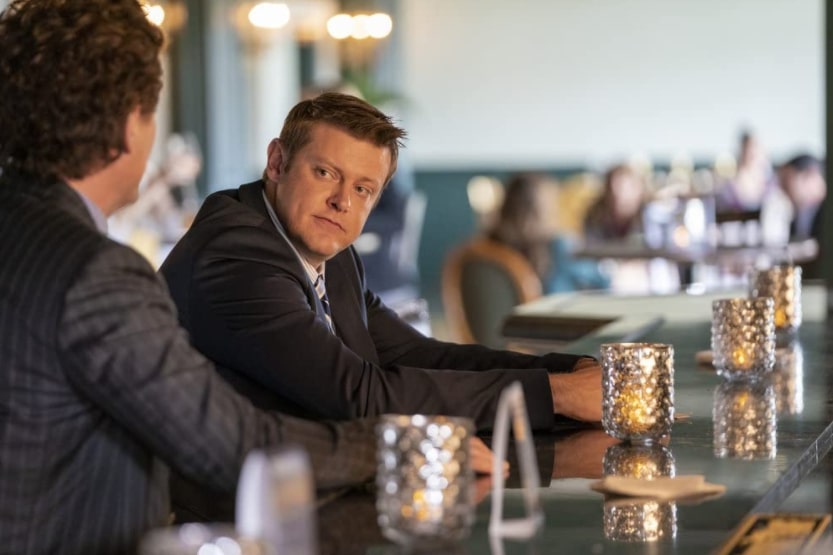
Locate an element on the screen. candles is located at coordinates (650, 397), (751, 302), (791, 290).